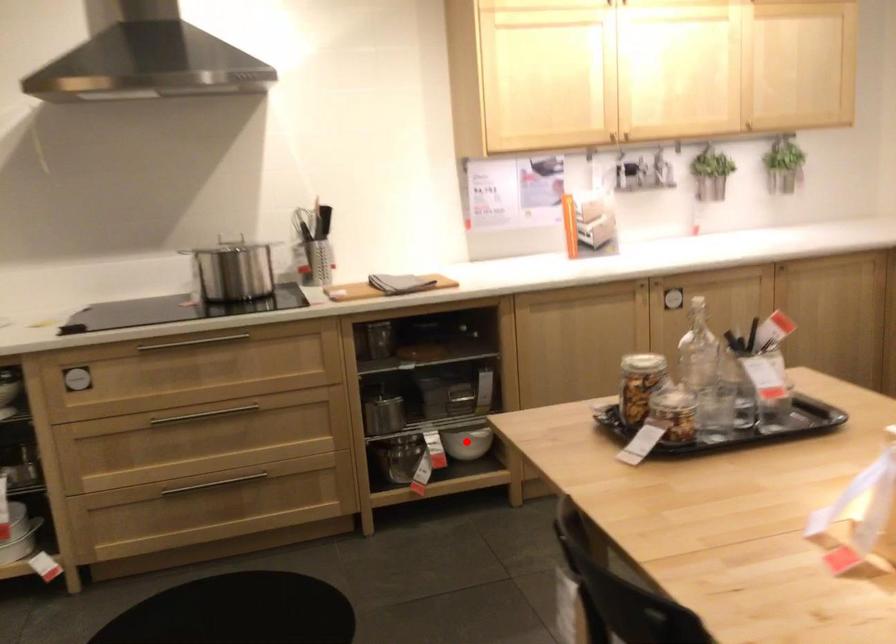
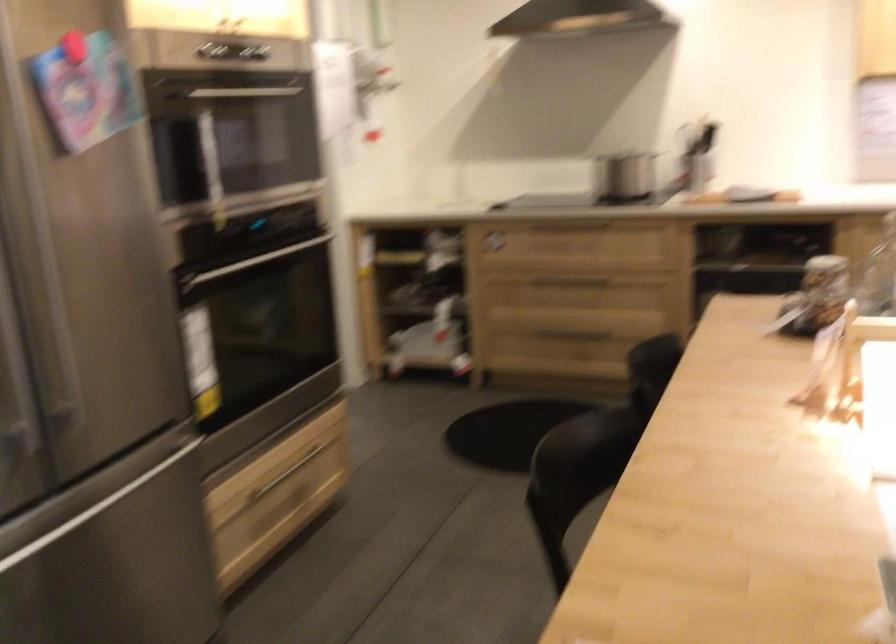
Question: I am providing you with two images of the same scene from different viewpoints. A red point is marked on the first image. Is the red point's position out of view in image 2?

Choices:
 (A) Yes
 (B) No

Answer: (A)